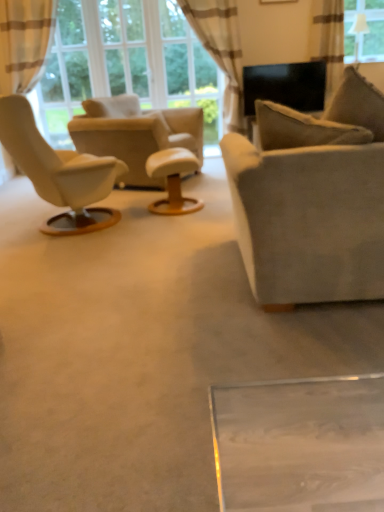
Question: Is satin beige curtain at upper right, the first curtain in the right-to-left sequence, facing away from suede beige chair at center?

Choices:
 (A) yes
 (B) no

Answer: (B)

Question: Is satin beige curtain at upper right, positioned as the 3th curtain in left-to-right order, smaller than suede beige chair at center?

Choices:
 (A) yes
 (B) no

Answer: (A)

Question: Is satin beige curtain at upper right, the first curtain in the right-to-left sequence, at the left side of suede beige chair at center?

Choices:
 (A) yes
 (B) no

Answer: (B)

Question: Is satin beige curtain at upper right, positioned as the 3th curtain in left-to-right order, next to suede beige chair at center and touching it?

Choices:
 (A) yes
 (B) no

Answer: (B)

Question: Does satin beige curtain at upper right, the first curtain in the right-to-left sequence, come behind suede beige chair at center?

Choices:
 (A) no
 (B) yes

Answer: (B)

Question: Is satin beige curtain at upper right, positioned as the 3th curtain in left-to-right order, at the right side of suede beige chair at center?

Choices:
 (A) yes
 (B) no

Answer: (A)

Question: Can you confirm if beige striped curtain at upper center, which is counted as the 2th curtain, starting from the right, is wider than matte black picture frame at upper center?

Choices:
 (A) yes
 (B) no

Answer: (A)

Question: Is beige striped curtain at upper center, which is counted as the 2th curtain, starting from the left, further to camera compared to matte black picture frame at upper center?

Choices:
 (A) yes
 (B) no

Answer: (B)

Question: Is beige striped curtain at upper center, which is counted as the 2th curtain, starting from the left, bigger than matte black picture frame at upper center?

Choices:
 (A) no
 (B) yes

Answer: (B)

Question: Are beige striped curtain at upper center, which is counted as the 2th curtain, starting from the left, and matte black picture frame at upper center located far from each other?

Choices:
 (A) yes
 (B) no

Answer: (B)

Question: From the image's perspective, is beige striped curtain at upper center, which is counted as the 2th curtain, starting from the left, located beneath matte black picture frame at upper center?

Choices:
 (A) no
 (B) yes

Answer: (B)

Question: From a real-world perspective, is beige striped curtain at upper center, which is counted as the 2th curtain, starting from the right, located higher than matte black picture frame at upper center?

Choices:
 (A) yes
 (B) no

Answer: (B)

Question: Does white leather ottoman at center touch suede couch at center?

Choices:
 (A) yes
 (B) no

Answer: (B)